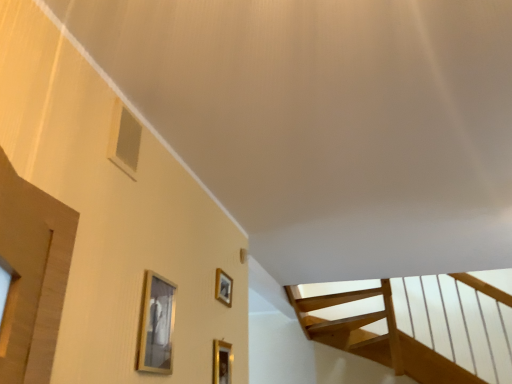
This screenshot has height=384, width=512. Find the location of `matte silver picture frame at center, placed as the 2th picture frame when sorted from left to right`. matte silver picture frame at center, placed as the 2th picture frame when sorted from left to right is located at coordinates (223, 287).

From a real-world perspective, who is located higher, matte silver picture frame at center, positioned as the first picture frame in back-to-front order, or gold metallic picture frame at lower center, positioned as the second picture frame in front-to-back order?

matte silver picture frame at center, positioned as the first picture frame in back-to-front order.

Could you measure the distance between matte silver picture frame at center, positioned as the first picture frame in back-to-front order, and gold metallic picture frame at lower center, the 3th picture frame viewed from the left?

11.04 inches.

Does matte silver picture frame at center, the second picture frame positioned from the right, come in front of gold metallic picture frame at lower center, the 1th picture frame from the right?

No, matte silver picture frame at center, the second picture frame positioned from the right, is further to the viewer.

Can we say matte silver picture frame at center, placed as the 2th picture frame when sorted from left to right, lies outside gold metallic picture frame at lower center, the 1th picture frame from the right?

Absolutely, matte silver picture frame at center, placed as the 2th picture frame when sorted from left to right, is external to gold metallic picture frame at lower center, the 1th picture frame from the right.

Is matte silver picture frame at center, acting as the third picture frame starting from the front, closer to the viewer compared to gold metallic picture frame at lower center, which appears as the 1th picture frame when viewed from the left?

No, matte silver picture frame at center, acting as the third picture frame starting from the front, is further to the viewer.

From a real-world perspective, is matte silver picture frame at center, placed as the 2th picture frame when sorted from left to right, physically below gold metallic picture frame at lower center, which appears as the 1th picture frame when viewed from the left?

No, from a real-world perspective, matte silver picture frame at center, placed as the 2th picture frame when sorted from left to right, is not under gold metallic picture frame at lower center, which appears as the 1th picture frame when viewed from the left.

From the image's perspective, is matte silver picture frame at center, the second picture frame positioned from the right, beneath gold metallic picture frame at lower center, which appears as the 1th picture frame when viewed from the left?

Correct, matte silver picture frame at center, the second picture frame positioned from the right, appears lower than gold metallic picture frame at lower center, which appears as the 1th picture frame when viewed from the left, in the image.

Looking at this image, considering the sizes of matte silver picture frame at center, placed as the 2th picture frame when sorted from left to right, and gold metallic picture frame at lower center, the 1th picture frame positioned from the front, in the image, is matte silver picture frame at center, placed as the 2th picture frame when sorted from left to right, taller or shorter than gold metallic picture frame at lower center, the 1th picture frame positioned from the front,?

In the image, matte silver picture frame at center, placed as the 2th picture frame when sorted from left to right, appears to be shorter than gold metallic picture frame at lower center, the 1th picture frame positioned from the front.

Is gold metallic picture frame at lower center, positioned as the second picture frame in front-to-back order, situated inside matte silver picture frame at center, the second picture frame positioned from the right, or outside?

gold metallic picture frame at lower center, positioned as the second picture frame in front-to-back order, lies outside matte silver picture frame at center, the second picture frame positioned from the right.

Considering the relative sizes of gold metallic picture frame at lower center, positioned as the second picture frame in front-to-back order, and matte silver picture frame at center, positioned as the first picture frame in back-to-front order, in the image provided, is gold metallic picture frame at lower center, positioned as the second picture frame in front-to-back order, shorter than matte silver picture frame at center, positioned as the first picture frame in back-to-front order,?

Incorrect, the height of gold metallic picture frame at lower center, positioned as the second picture frame in front-to-back order, does not fall short of that of matte silver picture frame at center, positioned as the first picture frame in back-to-front order.

Are gold metallic picture frame at lower center, the 3th picture frame viewed from the left, and matte silver picture frame at center, acting as the third picture frame starting from the front, far apart?

Actually, gold metallic picture frame at lower center, the 3th picture frame viewed from the left, and matte silver picture frame at center, acting as the third picture frame starting from the front, are a little close together.

Consider the image. From the image's perspective, which is above, gold metallic picture frame at lower center, positioned as the second picture frame in back-to-front order, or matte silver picture frame at center, placed as the 2th picture frame when sorted from left to right?

matte silver picture frame at center, placed as the 2th picture frame when sorted from left to right.

Is gold metallic picture frame at lower center, which appears as the 1th picture frame when viewed from the left, bigger or smaller than matte silver picture frame at center, acting as the third picture frame starting from the front?

Clearly, gold metallic picture frame at lower center, which appears as the 1th picture frame when viewed from the left, is larger in size than matte silver picture frame at center, acting as the third picture frame starting from the front.

Which point is more distant from viewer, [151,345] or [217,284]?

The point [217,284] is farther.

Does gold metallic picture frame at lower center, marked as the 3th picture frame in a right-to-left arrangement, have a greater width compared to matte silver picture frame at center, placed as the 2th picture frame when sorted from left to right?

Yes.

Is gold metallic picture frame at lower center, which is counted as the third picture frame, starting from the back, facing away from gold metallic picture frame at lower center, positioned as the second picture frame in front-to-back order?

No, gold metallic picture frame at lower center, positioned as the second picture frame in front-to-back order, is not at the back of gold metallic picture frame at lower center, which is counted as the third picture frame, starting from the back.

Is gold metallic picture frame at lower center, which is counted as the third picture frame, starting from the back, located outside gold metallic picture frame at lower center, positioned as the second picture frame in back-to-front order?

Yes, gold metallic picture frame at lower center, which is counted as the third picture frame, starting from the back, is not within gold metallic picture frame at lower center, positioned as the second picture frame in back-to-front order.

From the picture: From a real-world perspective, between gold metallic picture frame at lower center, which is counted as the third picture frame, starting from the back, and gold metallic picture frame at lower center, the 1th picture frame from the right, who is vertically lower?

gold metallic picture frame at lower center, the 1th picture frame from the right, from a real-world perspective.

What's the angular difference between gold metallic picture frame at lower center, marked as the 3th picture frame in a right-to-left arrangement, and gold metallic picture frame at lower center, positioned as the second picture frame in back-to-front order,'s facing directions?

0.00333 degrees separate the facing orientations of gold metallic picture frame at lower center, marked as the 3th picture frame in a right-to-left arrangement, and gold metallic picture frame at lower center, positioned as the second picture frame in back-to-front order.

The image size is (512, 384). In order to click on picture frame below the gold metallic picture frame at lower center, the 1th picture frame positioned from the front (from a real-world perspective) in this screenshot , I will do `click(222, 362)`.

Which of these two, gold metallic picture frame at lower center, positioned as the second picture frame in front-to-back order, or gold metallic picture frame at lower center, which appears as the 1th picture frame when viewed from the left, is smaller?

With smaller size is gold metallic picture frame at lower center, positioned as the second picture frame in front-to-back order.

From the picture: Can you confirm if gold metallic picture frame at lower center, positioned as the second picture frame in front-to-back order, is thinner than gold metallic picture frame at lower center, which appears as the 1th picture frame when viewed from the left?

Yes.

Based on the photo, are gold metallic picture frame at lower center, positioned as the second picture frame in back-to-front order, and gold metallic picture frame at lower center, the 1th picture frame positioned from the front, making contact?

No, gold metallic picture frame at lower center, positioned as the second picture frame in back-to-front order, is not in contact with gold metallic picture frame at lower center, the 1th picture frame positioned from the front.

From a real-world perspective, starting from the matte silver picture frame at center, placed as the 2th picture frame when sorted from left to right, which picture frame is the 2nd one below it? Please provide its 2D coordinates.

[(222, 362)]

In order to click on picture frame above the gold metallic picture frame at lower center, the 1th picture frame positioned from the front (from a real-world perspective) in this screenshot , I will do `click(223, 287)`.

When comparing their distances from gold metallic picture frame at lower center, positioned as the second picture frame in back-to-front order, does matte silver picture frame at center, the second picture frame positioned from the right, or gold metallic picture frame at lower center, which is counted as the third picture frame, starting from the back, seem further?

gold metallic picture frame at lower center, which is counted as the third picture frame, starting from the back.

Looking at the image, which one is located closer to gold metallic picture frame at lower center, which appears as the 1th picture frame when viewed from the left, matte silver picture frame at center, placed as the 2th picture frame when sorted from left to right, or gold metallic picture frame at lower center, the 3th picture frame viewed from the left?

gold metallic picture frame at lower center, the 3th picture frame viewed from the left, is closer to gold metallic picture frame at lower center, which appears as the 1th picture frame when viewed from the left.

When comparing their distances from gold metallic picture frame at lower center, the 3th picture frame viewed from the left, does gold metallic picture frame at lower center, which appears as the 1th picture frame when viewed from the left, or matte silver picture frame at center, positioned as the first picture frame in back-to-front order, seem closer?

The object closer to gold metallic picture frame at lower center, the 3th picture frame viewed from the left, is matte silver picture frame at center, positioned as the first picture frame in back-to-front order.

When comparing their distances from matte silver picture frame at center, acting as the third picture frame starting from the front, does gold metallic picture frame at lower center, the 3th picture frame viewed from the left, or gold metallic picture frame at lower center, marked as the 3th picture frame in a right-to-left arrangement, seem closer?

Among the two, gold metallic picture frame at lower center, the 3th picture frame viewed from the left, is located nearer to matte silver picture frame at center, acting as the third picture frame starting from the front.

Considering their positions, is gold metallic picture frame at lower center, which appears as the 1th picture frame when viewed from the left, positioned further to matte silver picture frame at center, positioned as the first picture frame in back-to-front order, than gold metallic picture frame at lower center, positioned as the second picture frame in front-to-back order?

gold metallic picture frame at lower center, which appears as the 1th picture frame when viewed from the left.

Looking at the image, which one is located further to gold metallic picture frame at lower center, which appears as the 1th picture frame when viewed from the left, gold metallic picture frame at lower center, positioned as the second picture frame in front-to-back order, or matte silver picture frame at center, positioned as the first picture frame in back-to-front order?

The object further to gold metallic picture frame at lower center, which appears as the 1th picture frame when viewed from the left, is matte silver picture frame at center, positioned as the first picture frame in back-to-front order.

I want to click on picture frame positioned between gold metallic picture frame at lower center, which appears as the 1th picture frame when viewed from the left, and matte silver picture frame at center, positioned as the first picture frame in back-to-front order, from near to far, so click(222, 362).